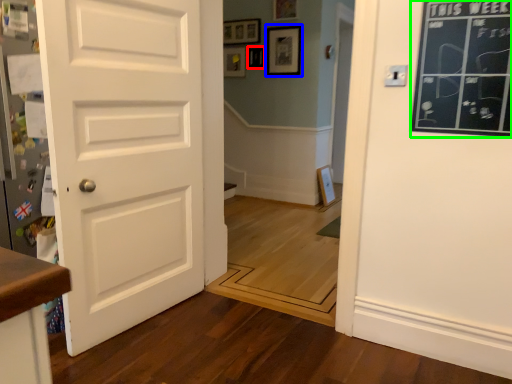
Question: Estimate the real-world distances between objects in this image. Which object is farther from picture frame (highlighted by a red box), picture frame (highlighted by a blue box) or bulletin board (highlighted by a green box)?

Choices:
 (A) picture frame
 (B) bulletin board

Answer: (B)